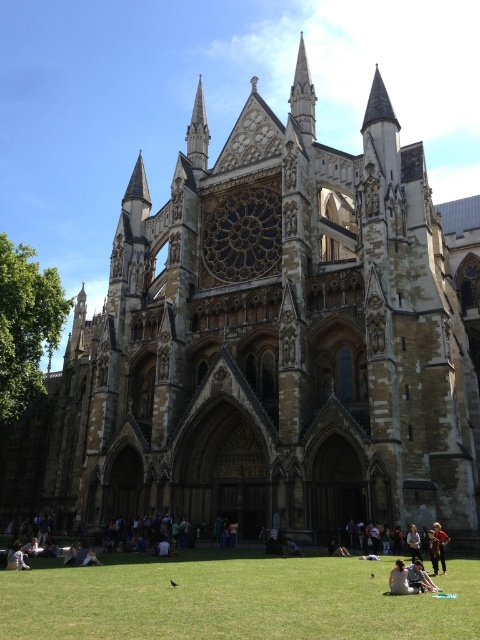
Does light brown hair at lower center appear on the left side of dark blue jeans at lower center?

Incorrect, light brown hair at lower center is not on the left side of dark blue jeans at lower center.

Find the location of a particular element. The width and height of the screenshot is (480, 640). light brown hair at lower center is located at coordinates (399, 579).

What do you see at coordinates (399, 579) in the screenshot?
I see `light brown hair at lower center` at bounding box center [399, 579].

Where is `light brown hair at lower center`? light brown hair at lower center is located at coordinates (399, 579).

Does green grass at lower center have a lesser width compared to blue denim jeans at center?

No.

Can you confirm if green grass at lower center is shorter than blue denim jeans at center?

No.

Which is behind, point (146, 621) or point (287, 548)?

Point (287, 548)

The image size is (480, 640). Find the location of `green grass at lower center`. green grass at lower center is located at coordinates (235, 602).

Which is in front, point (393, 593) or point (298, 547)?

Point (393, 593)

Is light brown hair at lower center wider than blue denim jeans at center?

Yes, light brown hair at lower center is wider than blue denim jeans at center.

I want to click on light brown hair at lower center, so click(x=399, y=579).